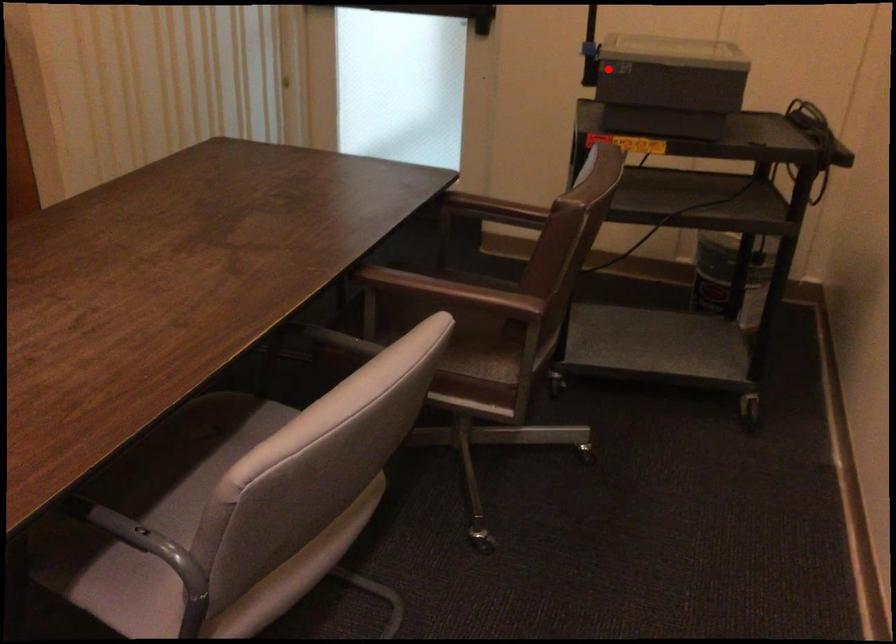
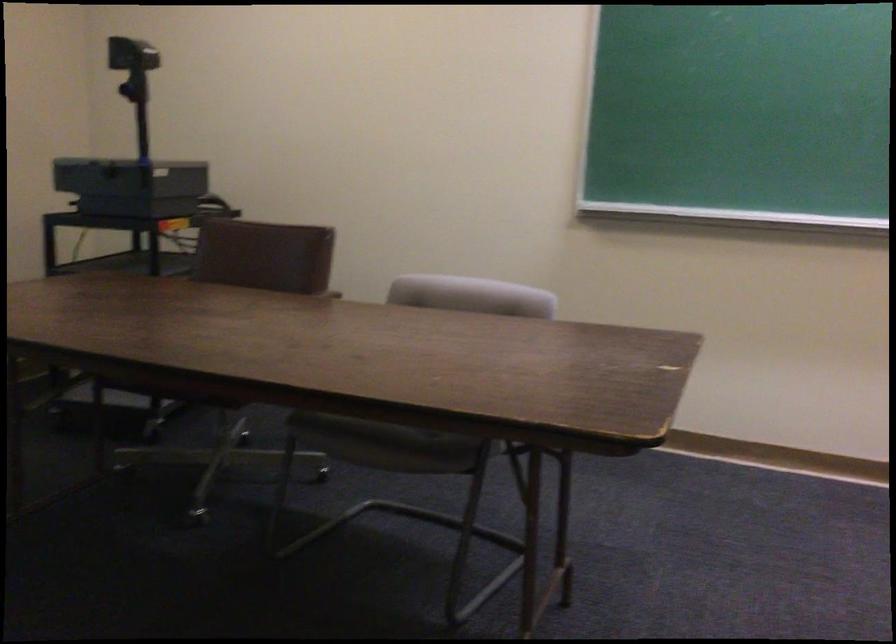
Question: I am providing you with two images of the same scene from different viewpoints. A red point is shown in image1. For the corresponding object point in image2, is it positioned nearer or farther from the camera?

Choices:
 (A) Nearer
 (B) Farther

Answer: (B)